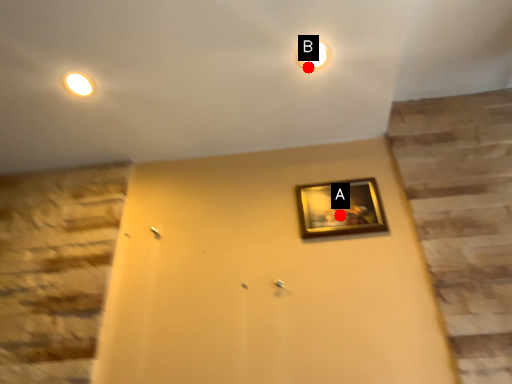
Question: Two points are circled on the image, labeled by A and B beside each circle. Which point is further to the camera?

Choices:
 (A) A is further
 (B) B is further

Answer: (A)